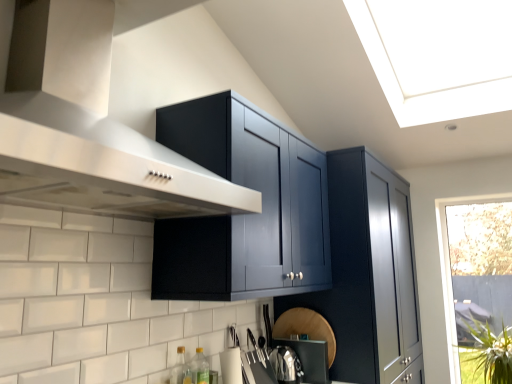
Find the location of a particular element. green leafy plant at lower right is located at coordinates (490, 353).

The height and width of the screenshot is (384, 512). What do you see at coordinates (450, 269) in the screenshot?
I see `transparent glass window at right` at bounding box center [450, 269].

What do you see at coordinates (180, 369) in the screenshot? I see `translucent glass bottle at lower left, positioned as the 2th bottle in back-to-front order` at bounding box center [180, 369].

At what (x,y) coordinates should I click in order to perform the action: click on stainless steel vent at upper left. Please return your answer as a coordinate pair (x, y). The height and width of the screenshot is (384, 512). Looking at the image, I should click on (102, 142).

What do you see at coordinates (286, 365) in the screenshot?
I see `satin silver kettle at lower center` at bounding box center [286, 365].

Measure the distance between point (207, 370) and camera.

Point (207, 370) and camera are 1.81 meters apart from each other.

This screenshot has height=384, width=512. In order to click on green leafy plant at lower right in this screenshot , I will do `click(490, 353)`.

From a real-world perspective, which object rests below the other?

In real-world perspective, green leafy plant at lower right is lower.

Which of these two, green leafy plant at lower right or satin silver kettle at lower center, stands shorter?

With less height is satin silver kettle at lower center.

Is green leafy plant at lower right not near satin silver kettle at lower center?

That's right, there is a large distance between green leafy plant at lower right and satin silver kettle at lower center.

Which of these two, green leafy plant at lower right or satin silver kettle at lower center, is wider?

With larger width is green leafy plant at lower right.

Based on the photo, is the depth of translucent glass bottle at lower left, positioned as the 2th bottle in back-to-front order, greater than that of satin silver kettle at lower center?

No.

Considering the relative sizes of translucent glass bottle at lower left, which appears as the first bottle when viewed from the front, and satin silver kettle at lower center in the image provided, is translucent glass bottle at lower left, which appears as the first bottle when viewed from the front, thinner than satin silver kettle at lower center?

Yes, translucent glass bottle at lower left, which appears as the first bottle when viewed from the front, is thinner than satin silver kettle at lower center.

From a real-world perspective, which object rests below the other?

From a 3D spatial view, satin silver kettle at lower center is below.

Between translucent glass bottle at lower left, which appears as the first bottle when viewed from the front, and satin silver kettle at lower center, which one has larger size?

With larger size is satin silver kettle at lower center.

From a real-world perspective, is translucent glass bottle at lower left, positioned as the 2th bottle in back-to-front order, positioned over glossy dark blue cabinet at upper center based on gravity?

Incorrect, from a real-world perspective, translucent glass bottle at lower left, positioned as the 2th bottle in back-to-front order, is lower than glossy dark blue cabinet at upper center.

Considering their positions, is translucent glass bottle at lower left, positioned as the 2th bottle in back-to-front order, located in front of or behind glossy dark blue cabinet at upper center?

Clearly, translucent glass bottle at lower left, positioned as the 2th bottle in back-to-front order, is in front of glossy dark blue cabinet at upper center.

In the scene shown: Are translucent glass bottle at lower left, positioned as the 2th bottle in back-to-front order, and glossy dark blue cabinet at upper center located far from each other?

Yes, translucent glass bottle at lower left, positioned as the 2th bottle in back-to-front order, is far from glossy dark blue cabinet at upper center.

From the picture: Which is more to the right, translucent glass bottle at lower left, which appears as the first bottle when viewed from the front, or glossy dark blue cabinet at upper center?

From the viewer's perspective, glossy dark blue cabinet at upper center appears more on the right side.

From the image's perspective, is satin silver kettle at lower center on top of green glass bottle at lower center, which is the 1th bottle from back to front?

No, from the image's perspective, satin silver kettle at lower center is not over green glass bottle at lower center, which is the 1th bottle from back to front.

Between satin silver kettle at lower center and green glass bottle at lower center, the second bottle positioned from the front, which one is positioned in front?

green glass bottle at lower center, the second bottle positioned from the front, is in front.

Considering the relative positions of satin silver kettle at lower center and green glass bottle at lower center, the second bottle positioned from the front, in the image provided, is satin silver kettle at lower center to the right of green glass bottle at lower center, the second bottle positioned from the front, from the viewer's perspective?

Indeed, satin silver kettle at lower center is positioned on the right side of green glass bottle at lower center, the second bottle positioned from the front.

Between satin silver kettle at lower center and green glass bottle at lower center, which is the 1th bottle from back to front, which one has more height?

green glass bottle at lower center, which is the 1th bottle from back to front, is taller.

Can we say transparent glass window at right lies outside satin silver kettle at lower center?

Yes.

I want to click on window on the right of satin silver kettle at lower center, so (450, 269).

Is transparent glass window at right placed right next to satin silver kettle at lower center?

There is a gap between transparent glass window at right and satin silver kettle at lower center.

Is stainless steel vent at upper left oriented towards transparent glass window at right?

No, stainless steel vent at upper left does not turn towards transparent glass window at right.

From the image's perspective, relative to transparent glass window at right, is stainless steel vent at upper left above or below?

Clearly, from the image's perspective, stainless steel vent at upper left is above transparent glass window at right.

Is point (40, 61) closer or farther from the camera than point (440, 250)?

Point (40, 61).

Between satin silver kettle at lower center and green leafy plant at lower right, which one has smaller size?

Smaller between the two is satin silver kettle at lower center.

From the picture: Can you confirm if satin silver kettle at lower center is thinner than green leafy plant at lower right?

Indeed, satin silver kettle at lower center has a lesser width compared to green leafy plant at lower right.

From a real-world perspective, is satin silver kettle at lower center positioned above or below green leafy plant at lower right?

In terms of real-world spatial position, satin silver kettle at lower center is above green leafy plant at lower right.

Locate an element on the screen. The height and width of the screenshot is (384, 512). appliance in front of the green leafy plant at lower right is located at coordinates (286, 365).

Identify the location of appliance that is under the translucent glass bottle at lower left, which appears as the first bottle when viewed from the front (from a real-world perspective). This screenshot has width=512, height=384. (286, 365).

From the image, which object appears to be nearer to satin silver kettle at lower center, transparent glass window at right or green glass bottle at lower center, the second bottle positioned from the front?

Based on the image, green glass bottle at lower center, the second bottle positioned from the front, appears to be nearer to satin silver kettle at lower center.

Based on their spatial positions, is green glass bottle at lower center, the second bottle positioned from the front, or translucent glass bottle at lower left, positioned as the 2th bottle in back-to-front order, further from glossy dark blue cabinet at upper center?

translucent glass bottle at lower left, positioned as the 2th bottle in back-to-front order, lies further to glossy dark blue cabinet at upper center than the other object.

Which object lies nearer to the anchor point green leafy plant at lower right, satin silver kettle at lower center or green glass bottle at lower center, the second bottle positioned from the front?

satin silver kettle at lower center is positioned closer to the anchor green leafy plant at lower right.

Based on the photo, based on their spatial positions, is glossy dark blue cabinet at upper center or translucent glass bottle at lower left, positioned as the 2th bottle in back-to-front order, closer to transparent glass window at right?

glossy dark blue cabinet at upper center.

Considering their positions, is satin silver kettle at lower center positioned closer to transparent glass window at right than green glass bottle at lower center, which is the 1th bottle from back to front?

satin silver kettle at lower center.

Based on their spatial positions, is green glass bottle at lower center, the second bottle positioned from the front, or translucent glass bottle at lower left, positioned as the 2th bottle in back-to-front order, closer to transparent glass window at right?

Among the two, green glass bottle at lower center, the second bottle positioned from the front, is located nearer to transparent glass window at right.

Estimate the real-world distances between objects in this image. Which object is further from green leafy plant at lower right, satin silver kettle at lower center or stainless steel vent at upper left?

stainless steel vent at upper left is positioned further to the anchor green leafy plant at lower right.

Consider the image. Considering their positions, is green leafy plant at lower right positioned further to glossy dark blue cabinet at upper center than green glass bottle at lower center, which is the 1th bottle from back to front?

The object further to glossy dark blue cabinet at upper center is green leafy plant at lower right.

The width and height of the screenshot is (512, 384). I want to click on bottle between translucent glass bottle at lower left, positioned as the 2th bottle in back-to-front order, and satin silver kettle at lower center from left to right, so click(x=199, y=368).

Locate an element on the screen. bottle between translucent glass bottle at lower left, which appears as the first bottle when viewed from the front, and green leafy plant at lower right is located at coordinates (199, 368).

You are a GUI agent. You are given a task and a screenshot of the screen. Output one action in this format:
    pyautogui.click(x=<x>, y=<y>)
    Task: Click on the plant between green glass bottle at lower center, the second bottle positioned from the front, and transparent glass window at right from left to right
    The image size is (512, 384).
    Given the screenshot: What is the action you would take?
    pyautogui.click(x=490, y=353)

This screenshot has width=512, height=384. Identify the location of cabinetry situated between satin silver kettle at lower center and transparent glass window at right from left to right. (368, 274).